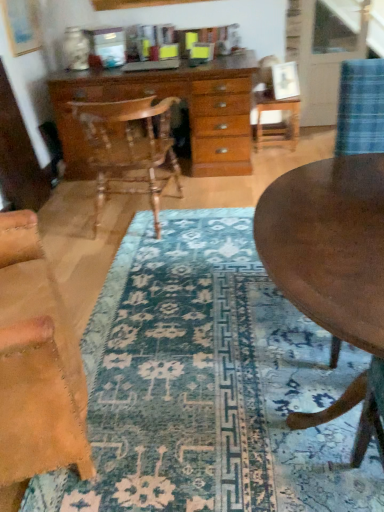
I want to click on vacant point above wooden round table at center (from a real-world perspective), so click(323, 230).